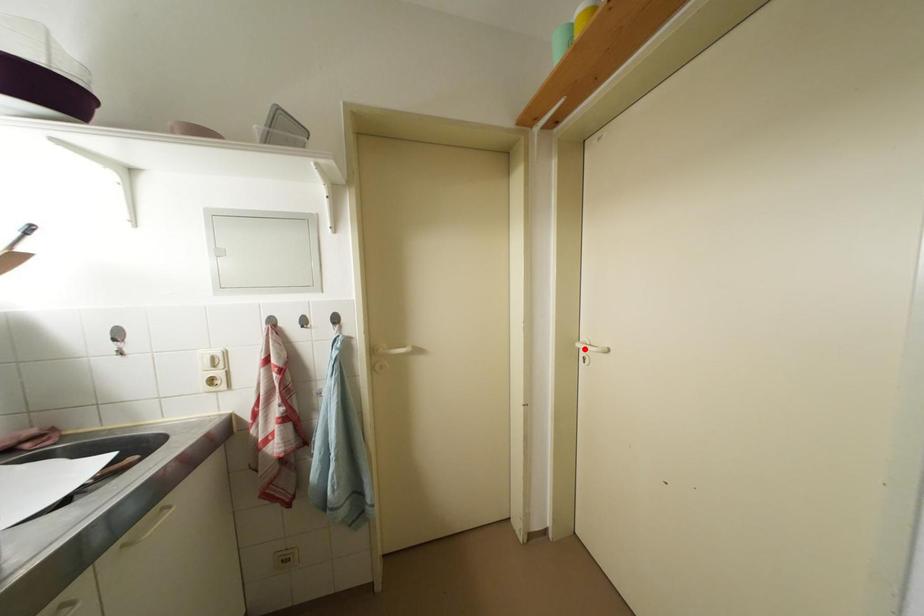
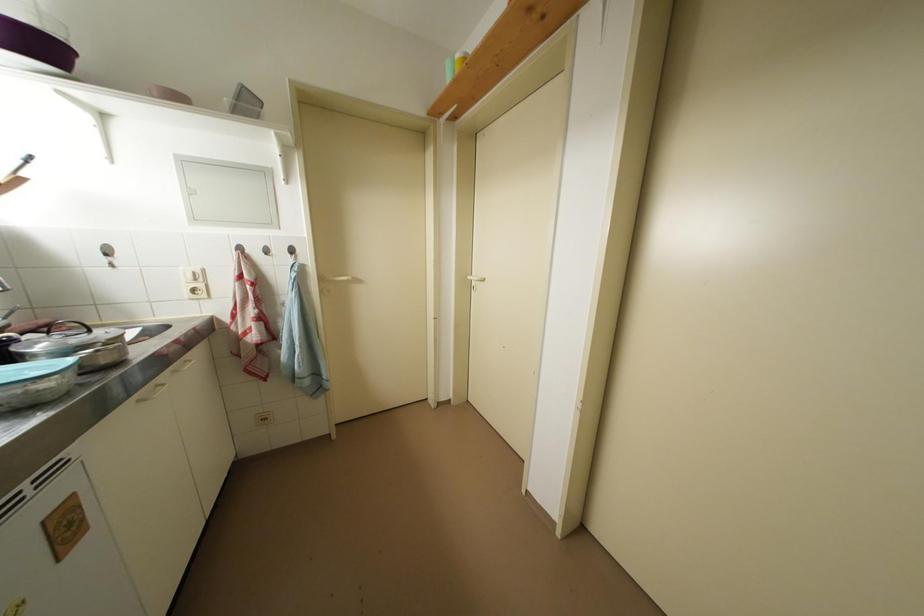
The point at the highlighted location is marked in the first image. Where is the corresponding point in the second image?

(476, 282)